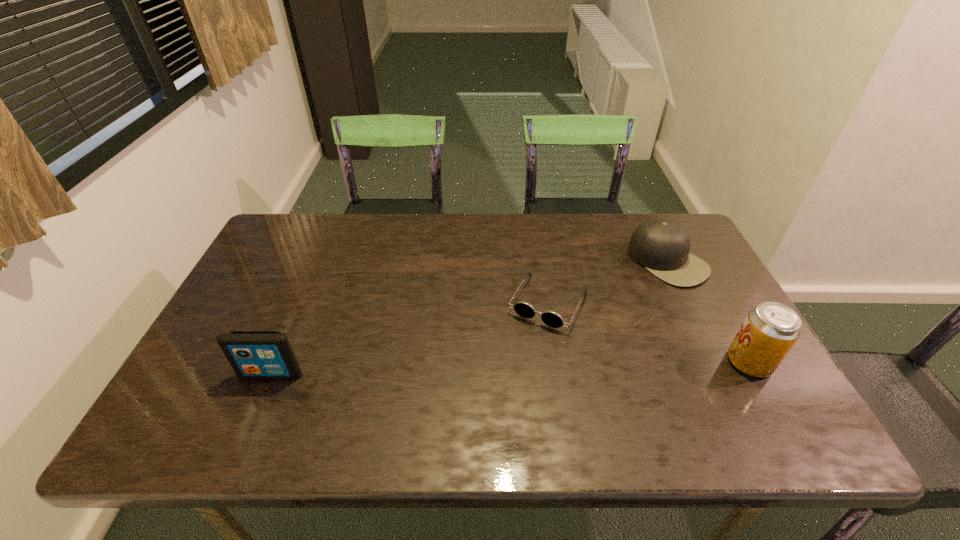
You are a GUI agent. You are given a task and a screenshot of the screen. Output one action in this format:
    pyautogui.click(x=<x>, y=<y>)
    Task: Click on the free spot on the desktop that is between the leftmost object and the pop (soda) and is positioned on the front-facing side of the third object from right to left
    The height and width of the screenshot is (540, 960).
    Given the screenshot: What is the action you would take?
    pyautogui.click(x=514, y=368)

The width and height of the screenshot is (960, 540). In order to click on vacant space on the desktop that is between the third shortest object and the pop (soda) and is positioned on the brim of the third tallest object in this screenshot , I will do `click(496, 368)`.